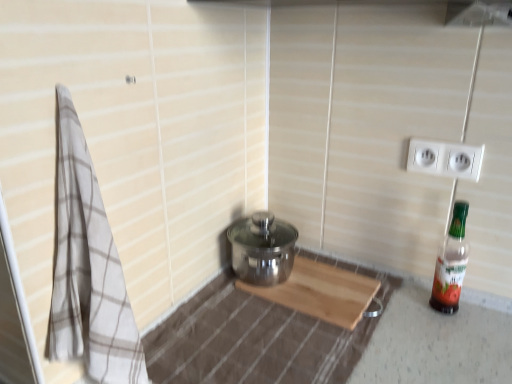
The width and height of the screenshot is (512, 384). Identify the location of beige checkered towel at left. (87, 268).

Considering the sizes of objects beige checkered towel at left and translucent plastic bottle at right in the image provided, who is thinner, beige checkered towel at left or translucent plastic bottle at right?

translucent plastic bottle at right.

From a real-world perspective, is beige checkered towel at left below translucent plastic bottle at right?

No, from a real-world perspective, beige checkered towel at left is not beneath translucent plastic bottle at right.

From the image's perspective, does beige checkered towel at left appear higher than translucent plastic bottle at right?

Yes.

Which is further, (106, 224) or (452, 264)?

The point (452, 264) is behind.

Is beige checkered towel at left located within white plastic electric outlet at upper right?

No, beige checkered towel at left is located outside of white plastic electric outlet at upper right.

From a real-world perspective, is white plastic electric outlet at upper right under beige checkered towel at left?

No, from a real-world perspective, white plastic electric outlet at upper right is not under beige checkered towel at left.

Could you tell me if white plastic electric outlet at upper right is facing beige checkered towel at left?

No, white plastic electric outlet at upper right does not turn towards beige checkered towel at left.

Based on the photo, how many degrees apart are the facing directions of white plastic electric outlet at upper right and beige checkered towel at left?

The facing directions of white plastic electric outlet at upper right and beige checkered towel at left are 88.5 degrees apart.

From a real-world perspective, is translucent plastic bottle at right physically below beige checkered towel at left?

Yes.

Is translucent plastic bottle at right taller than beige checkered towel at left?

No, translucent plastic bottle at right is not taller than beige checkered towel at left.

Locate an element on the screen. bath towel that is above the translucent plastic bottle at right (from the image's perspective) is located at coordinates (87, 268).

From the image's perspective, would you say translucent plastic bottle at right is positioned over beige checkered towel at left?

Actually, translucent plastic bottle at right appears below beige checkered towel at left in the image.

In the scene shown: Considering the relative sizes of white plastic electric outlet at upper right and translucent plastic bottle at right in the image provided, is white plastic electric outlet at upper right smaller than translucent plastic bottle at right?

Indeed, white plastic electric outlet at upper right has a smaller size compared to translucent plastic bottle at right.

Which object is positioned more to the left, white plastic electric outlet at upper right or translucent plastic bottle at right?

white plastic electric outlet at upper right.

Is white plastic electric outlet at upper right closer to camera compared to translucent plastic bottle at right?

No, the depth of white plastic electric outlet at upper right is greater than that of translucent plastic bottle at right.

Can you tell me how much white plastic electric outlet at upper right and translucent plastic bottle at right differ in facing direction?

white plastic electric outlet at upper right and translucent plastic bottle at right are facing 0.000222 degrees away from each other.

Based on the photo, from the image's perspective, relative to white plastic electric outlet at upper right, is beige checkered towel at left above or below?

beige checkered towel at left is situated lower than white plastic electric outlet at upper right in the image.

From a real-world perspective, relative to white plastic electric outlet at upper right, is beige checkered towel at left vertically above or below?

From a real-world perspective, beige checkered towel at left is physically below white plastic electric outlet at upper right.

Can you tell me how much beige checkered towel at left and white plastic electric outlet at upper right differ in facing direction?

88.5 degrees separate the facing orientations of beige checkered towel at left and white plastic electric outlet at upper right.

Consider the image. Considering the relative sizes of beige checkered towel at left and white plastic electric outlet at upper right in the image provided, is beige checkered towel at left taller than white plastic electric outlet at upper right?

Correct, beige checkered towel at left is much taller as white plastic electric outlet at upper right.

Where is `electric outlet on the left side of translucent plastic bottle at right`? This screenshot has height=384, width=512. electric outlet on the left side of translucent plastic bottle at right is located at coordinates (445, 159).

Is point (468, 249) closer to viewer compared to point (457, 173)?

No, (468, 249) is behind (457, 173).

In the scene shown: Is translucent plastic bottle at right not near white plastic electric outlet at upper right?

No, translucent plastic bottle at right is not far away from white plastic electric outlet at upper right.

Could you tell me if translucent plastic bottle at right is facing white plastic electric outlet at upper right?

No, translucent plastic bottle at right is not oriented towards white plastic electric outlet at upper right.

In the image, there is a beige checkered towel at left. Where is `bottle below it (from the image's perspective)`? bottle below it (from the image's perspective) is located at coordinates (451, 263).

Locate an element on the screen. bath towel on the left side of white plastic electric outlet at upper right is located at coordinates (87, 268).

Considering their positions, is white plastic electric outlet at upper right positioned further to beige checkered towel at left than translucent plastic bottle at right?

Based on the image, white plastic electric outlet at upper right appears to be further to beige checkered towel at left.

Considering their positions, is translucent plastic bottle at right positioned closer to white plastic electric outlet at upper right than beige checkered towel at left?

Based on the image, translucent plastic bottle at right appears to be nearer to white plastic electric outlet at upper right.

Which object lies nearer to the anchor point white plastic electric outlet at upper right, beige checkered towel at left or translucent plastic bottle at right?

translucent plastic bottle at right is closer to white plastic electric outlet at upper right.

Looking at the image, which one is located further to translucent plastic bottle at right, white plastic electric outlet at upper right or beige checkered towel at left?

beige checkered towel at left is positioned further to the anchor translucent plastic bottle at right.

Based on their spatial positions, is translucent plastic bottle at right or white plastic electric outlet at upper right closer to beige checkered towel at left?

translucent plastic bottle at right lies closer to beige checkered towel at left than the other object.

When comparing their distances from translucent plastic bottle at right, does beige checkered towel at left or white plastic electric outlet at upper right seem further?

beige checkered towel at left.

Identify the location of electric outlet located between beige checkered towel at left and translucent plastic bottle at right in the left-right direction. (445, 159).